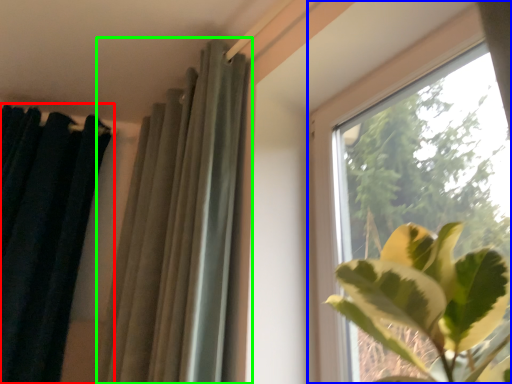
Question: Which object is the farthest from curtain (highlighted by a red box)? Choose among these: window (highlighted by a blue box) or curtain (highlighted by a green box).

Choices:
 (A) window
 (B) curtain

Answer: (A)